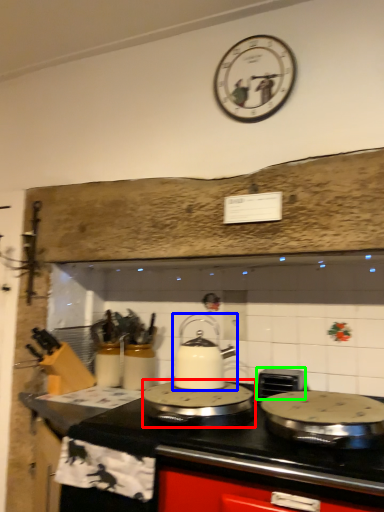
Question: Which object is the farthest from kitchen appliance (highlighted by a red box)? Choose among these: kitchen appliance (highlighted by a blue box) or appliance (highlighted by a green box).

Choices:
 (A) kitchen appliance
 (B) appliance

Answer: (B)